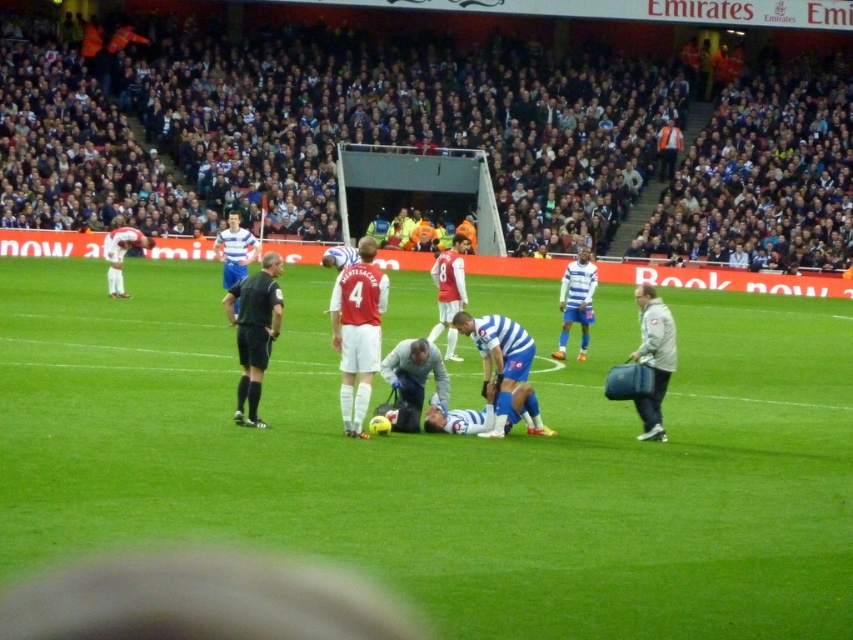
You are a soccer referee positioned at the center circle. You need to decide whether to call a foul based on the distance between the black uniform at center and blue fabric player at center. The rule states that if the distance between them is less than 5 meters, a foul is called. Can you determine if a foul should be called?

The black uniform at center is 8.21 meters away from blue fabric player at center. Since the distance is greater than 5 meters, no foul should be called.

You are a soccer player on the field and need to quickly grab the gray fabric bag at right before the game resumes. Can you reach it before the blue fabric player at center does, considering their heights?

The gray fabric bag at right is not as tall as the blue fabric player at center, so the player can reach it easily before the blue fabric player at center.

You are a soccer player who just got injured and need to access the gray fabric bag at right. Based on the coordinates provided in the description, can you reach it while lying on the ground?

The gray fabric bag at right is located at point (x=654, y=356). Since you are lying on the ground, you might not be able to reach it easily unless someone assists you.